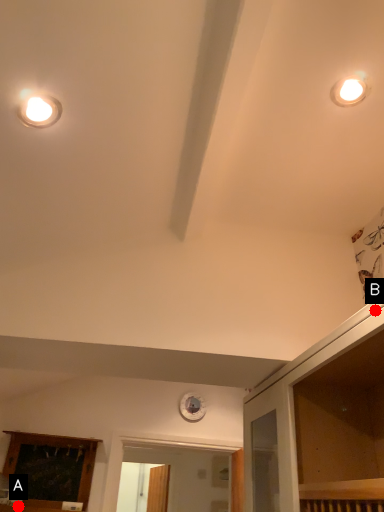
Question: Two points are circled on the image, labeled by A and B beside each circle. Among these points, which one is nearest to the camera?

Choices:
 (A) A is closer
 (B) B is closer

Answer: (B)